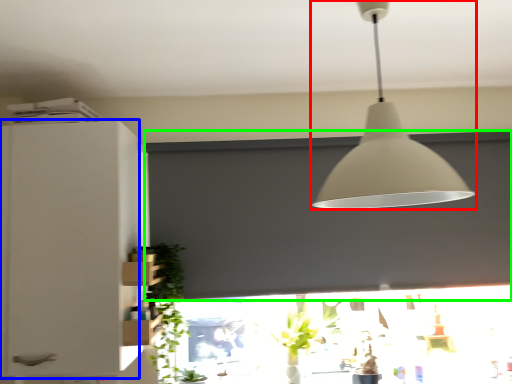
Question: Which object is the closest to the lamp (highlighted by a red box)? Choose among these: cabinetry (highlighted by a blue box) or window screen (highlighted by a green box).

Choices:
 (A) cabinetry
 (B) window screen

Answer: (B)